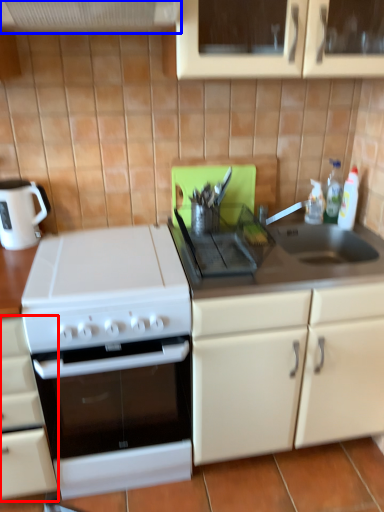
Question: Which of the following is the farthest to the observer, cabinetry (highlighted by a red box) or exhaust hood (highlighted by a blue box)?

Choices:
 (A) cabinetry
 (B) exhaust hood

Answer: (A)